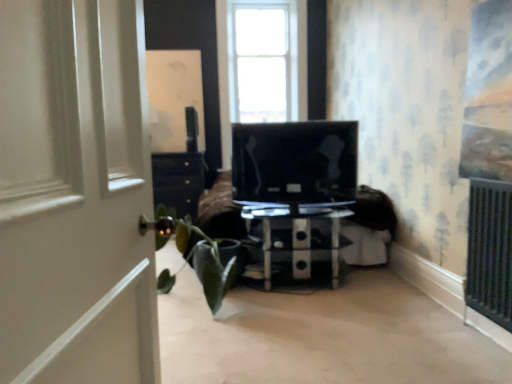
Question: Is transparent glass coffee table at center oriented towards green matte houseplant at left?

Choices:
 (A) no
 (B) yes

Answer: (A)

Question: Is transparent glass coffee table at center far from green matte houseplant at left?

Choices:
 (A) yes
 (B) no

Answer: (B)

Question: From a real-world perspective, is transparent glass coffee table at center on top of green matte houseplant at left?

Choices:
 (A) no
 (B) yes

Answer: (A)

Question: Is green matte houseplant at left at the back of transparent glass coffee table at center?

Choices:
 (A) no
 (B) yes

Answer: (A)

Question: Is transparent glass coffee table at center positioned beyond the bounds of green matte houseplant at left?

Choices:
 (A) yes
 (B) no

Answer: (A)

Question: From a real-world perspective, relative to transparent glass coffee table at center, is green matte houseplant at left vertically above or below?

Choices:
 (A) below
 (B) above

Answer: (B)

Question: Is green matte houseplant at left inside the boundaries of transparent glass coffee table at center, or outside?

Choices:
 (A) inside
 (B) outside

Answer: (B)

Question: From the image's perspective, is green matte houseplant at left above or below transparent glass coffee table at center?

Choices:
 (A) below
 (B) above

Answer: (B)

Question: In terms of height, does green matte houseplant at left look taller or shorter compared to transparent glass coffee table at center?

Choices:
 (A) tall
 (B) short

Answer: (A)

Question: In terms of width, does transparent glass coffee table at center look wider or thinner when compared to green matte houseplant at left?

Choices:
 (A) thin
 (B) wide

Answer: (A)

Question: Is transparent glass coffee table at center spatially inside green matte houseplant at left, or outside of it?

Choices:
 (A) inside
 (B) outside

Answer: (B)

Question: From the image's perspective, is transparent glass coffee table at center above or below green matte houseplant at left?

Choices:
 (A) above
 (B) below

Answer: (B)

Question: Considering their positions, is transparent glass coffee table at center located in front of or behind green matte houseplant at left?

Choices:
 (A) behind
 (B) front

Answer: (A)

Question: Is green matte houseplant at left to the left or to the right of black glossy tv at center in the image?

Choices:
 (A) right
 (B) left

Answer: (B)

Question: From the image's perspective, is green matte houseplant at left located above or below black glossy tv at center?

Choices:
 (A) below
 (B) above

Answer: (A)